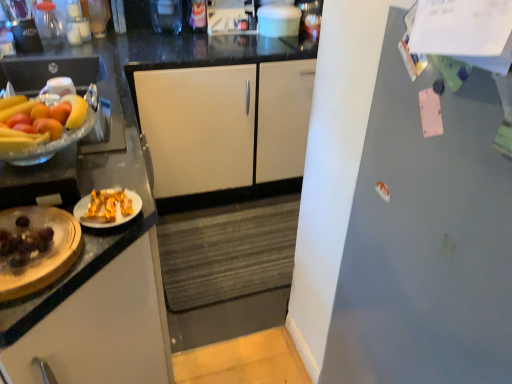
The image size is (512, 384). What are the coordinates of `shiny brown chocolate at left` in the screenshot? It's located at (24, 242).

What do you see at coordinates (24, 242) in the screenshot?
I see `shiny brown chocolate at left` at bounding box center [24, 242].

What do you see at coordinates (103, 328) in the screenshot? Image resolution: width=512 pixels, height=384 pixels. I see `white glossy plate at left, which ranks as the 2th cabinetry in top-to-bottom order` at bounding box center [103, 328].

Where is `gray matte refrigerator at right`? Image resolution: width=512 pixels, height=384 pixels. gray matte refrigerator at right is located at coordinates [x=426, y=239].

Image resolution: width=512 pixels, height=384 pixels. I want to click on white matte cabinet at center, which ranks as the first cabinetry in back-to-front order, so click(225, 124).

Considering the positions of objects white glossy plate at left, acting as the 1th cabinetry starting from the bottom, and white matte cabinet at center, which ranks as the first cabinetry in back-to-front order, in the image provided, who is behind, white glossy plate at left, acting as the 1th cabinetry starting from the bottom, or white matte cabinet at center, which ranks as the first cabinetry in back-to-front order,?

white matte cabinet at center, which ranks as the first cabinetry in back-to-front order, is further from the camera.

Does white glossy plate at left, the first cabinetry when ordered from front to back, have a greater height compared to white matte cabinet at center, which is the 2th cabinetry in front-to-back order?

Indeed, white glossy plate at left, the first cabinetry when ordered from front to back, has a greater height compared to white matte cabinet at center, which is the 2th cabinetry in front-to-back order.

Is white glossy plate at left, which ranks as the 2th cabinetry in top-to-bottom order, completely or partially outside of white matte cabinet at center, which is the 2th cabinetry in front-to-back order?

Absolutely, white glossy plate at left, which ranks as the 2th cabinetry in top-to-bottom order, is external to white matte cabinet at center, which is the 2th cabinetry in front-to-back order.

Would you consider white glossy plate at left, which is the second cabinetry from back to front, to be distant from white matte cabinet at center, marked as the first cabinetry in a top-to-bottom arrangement?

Absolutely, white glossy plate at left, which is the second cabinetry from back to front, is distant from white matte cabinet at center, marked as the first cabinetry in a top-to-bottom arrangement.

Measure the distance between white glossy plate at left, which ranks as the 2th cabinetry in top-to-bottom order, and yellow matte banana at left.

white glossy plate at left, which ranks as the 2th cabinetry in top-to-bottom order, is 20.81 inches away from yellow matte banana at left.

In terms of height, does white glossy plate at left, acting as the 1th cabinetry starting from the bottom, look taller or shorter compared to yellow matte banana at left?

white glossy plate at left, acting as the 1th cabinetry starting from the bottom, is taller than yellow matte banana at left.

Does white glossy plate at left, acting as the 1th cabinetry starting from the bottom, have a smaller size compared to yellow matte banana at left?

No.

Which of these two, white glossy plate at left, which ranks as the 2th cabinetry in top-to-bottom order, or yellow matte banana at left, is thinner?

Thinner between the two is yellow matte banana at left.

Does gray matte refrigerator at right have a smaller size compared to shiny brown chocolate at left?

No.

Is gray matte refrigerator at right oriented away from shiny brown chocolate at left?

That's not correct — gray matte refrigerator at right is not looking away from shiny brown chocolate at left.

Does gray matte refrigerator at right appear on the left side of shiny brown chocolate at left?

Incorrect, gray matte refrigerator at right is not on the left side of shiny brown chocolate at left.

Is gray matte refrigerator at right in front of shiny brown chocolate at left?

That is True.

Is yellow matte banana at left turned away from white matte cabinet at center, which ranks as the first cabinetry in back-to-front order?

yellow matte banana at left does not have its back to white matte cabinet at center, which ranks as the first cabinetry in back-to-front order.

This screenshot has width=512, height=384. Find the location of `banana in front of the white matte cabinet at center, which is the 2th cabinetry in front-to-back order`. banana in front of the white matte cabinet at center, which is the 2th cabinetry in front-to-back order is located at coordinates (75, 111).

Which object is positioned more to the left, yellow matte banana at left or white matte cabinet at center, which ranks as the first cabinetry in back-to-front order?

Positioned to the left is yellow matte banana at left.

Is the surface of yellow matte banana at left in direct contact with white matte cabinet at center, which ranks as the first cabinetry in back-to-front order?

No, yellow matte banana at left is not next to white matte cabinet at center, which ranks as the first cabinetry in back-to-front order.

Is gray matte refrigerator at right to the left of yellow matte grapefruit at left from the viewer's perspective?

Incorrect, gray matte refrigerator at right is not on the left side of yellow matte grapefruit at left.

Between gray matte refrigerator at right and yellow matte grapefruit at left, which one has smaller width?

yellow matte grapefruit at left is thinner.

Is there a large distance between gray matte refrigerator at right and yellow matte grapefruit at left?

No.

Would you say gray matte refrigerator at right is outside yellow matte grapefruit at left?

Absolutely, gray matte refrigerator at right is external to yellow matte grapefruit at left.

Considering the relative positions of shiny brown chocolate at left and yellow matte grapefruit at left in the image provided, is shiny brown chocolate at left to the right of yellow matte grapefruit at left from the viewer's perspective?

Indeed, shiny brown chocolate at left is positioned on the right side of yellow matte grapefruit at left.

Looking at this image, which is in front, shiny brown chocolate at left or yellow matte grapefruit at left?

shiny brown chocolate at left is closer to the camera.

Is shiny brown chocolate at left bigger than yellow matte grapefruit at left?

Actually, shiny brown chocolate at left might be smaller than yellow matte grapefruit at left.

From the image's perspective, is shiny brown chocolate at left located above or below yellow matte grapefruit at left?

shiny brown chocolate at left is below yellow matte grapefruit at left.

From the image's perspective, is shiny brown chocolate at left located beneath white glossy plate at left, the first cabinetry when ordered from front to back?

Incorrect, from the image's perspective, shiny brown chocolate at left is higher than white glossy plate at left, the first cabinetry when ordered from front to back.

Is shiny brown chocolate at left facing away from white glossy plate at left, acting as the 1th cabinetry starting from the bottom?

No.

From the picture: Which object is closer to the camera taking this photo, shiny brown chocolate at left or white glossy plate at left, the first cabinetry when ordered from front to back?

Positioned in front is white glossy plate at left, the first cabinetry when ordered from front to back.

Can you confirm if shiny brown chocolate at left is taller than white glossy plate at left, which ranks as the 2th cabinetry in top-to-bottom order?

No, shiny brown chocolate at left is not taller than white glossy plate at left, which ranks as the 2th cabinetry in top-to-bottom order.

Identify the location of cabinetry above the white glossy plate at left, the first cabinetry when ordered from front to back (from a real-world perspective). (225, 124).

Identify the location of cabinetry in front of the yellow matte banana at left. (103, 328).

Looking at the image, which one is located further to white glossy plate at left, which is the second cabinetry from back to front, gray matte refrigerator at right or yellow matte banana at left?

The object further to white glossy plate at left, which is the second cabinetry from back to front, is gray matte refrigerator at right.

Estimate the real-world distances between objects in this image. Which object is further from shiny brown chocolate at left, white matte cabinet at center, which is counted as the second cabinetry, starting from the bottom, or white glossy plate at left, which ranks as the 2th cabinetry in top-to-bottom order?

→ white matte cabinet at center, which is counted as the second cabinetry, starting from the bottom, is further to shiny brown chocolate at left.

Looking at the image, which one is located further to gray matte refrigerator at right, yellow matte grapefruit at left or yellow matte banana at left?

Among the two, yellow matte banana at left is located further to gray matte refrigerator at right.

Consider the image. When comparing their distances from yellow matte banana at left, does white matte cabinet at center, which is counted as the second cabinetry, starting from the bottom, or yellow matte grapefruit at left seem closer?

yellow matte grapefruit at left is positioned closer to the anchor yellow matte banana at left.

Considering their positions, is white matte cabinet at center, marked as the first cabinetry in a top-to-bottom arrangement, positioned further to yellow matte banana at left than shiny brown chocolate at left?

Among the two, white matte cabinet at center, marked as the first cabinetry in a top-to-bottom arrangement, is located further to yellow matte banana at left.

From the image, which object appears to be farther from gray matte refrigerator at right, shiny brown chocolate at left or yellow matte banana at left?

The object further to gray matte refrigerator at right is yellow matte banana at left.

When comparing their distances from gray matte refrigerator at right, does yellow matte banana at left or shiny brown chocolate at left seem closer?

shiny brown chocolate at left is closer to gray matte refrigerator at right.

Considering their positions, is gray matte refrigerator at right positioned further to shiny brown chocolate at left than yellow matte banana at left?

gray matte refrigerator at right is further to shiny brown chocolate at left.

I want to click on grapefruit between gray matte refrigerator at right and white matte cabinet at center, which ranks as the first cabinetry in back-to-front order, from front to back, so click(x=39, y=119).

The image size is (512, 384). Find the location of `banana between white glossy plate at left, acting as the 1th cabinetry starting from the bottom, and white matte cabinet at center, which ranks as the first cabinetry in back-to-front order, in the front-back direction`. banana between white glossy plate at left, acting as the 1th cabinetry starting from the bottom, and white matte cabinet at center, which ranks as the first cabinetry in back-to-front order, in the front-back direction is located at coordinates (75, 111).

Where is `food between gray matte refrigerator at right and white matte cabinet at center, which is counted as the second cabinetry, starting from the bottom, along the z-axis`? The height and width of the screenshot is (384, 512). food between gray matte refrigerator at right and white matte cabinet at center, which is counted as the second cabinetry, starting from the bottom, along the z-axis is located at coordinates (24, 242).

The height and width of the screenshot is (384, 512). Identify the location of food between white glossy plate at left, the first cabinetry when ordered from front to back, and gray matte refrigerator at right. pos(24,242).